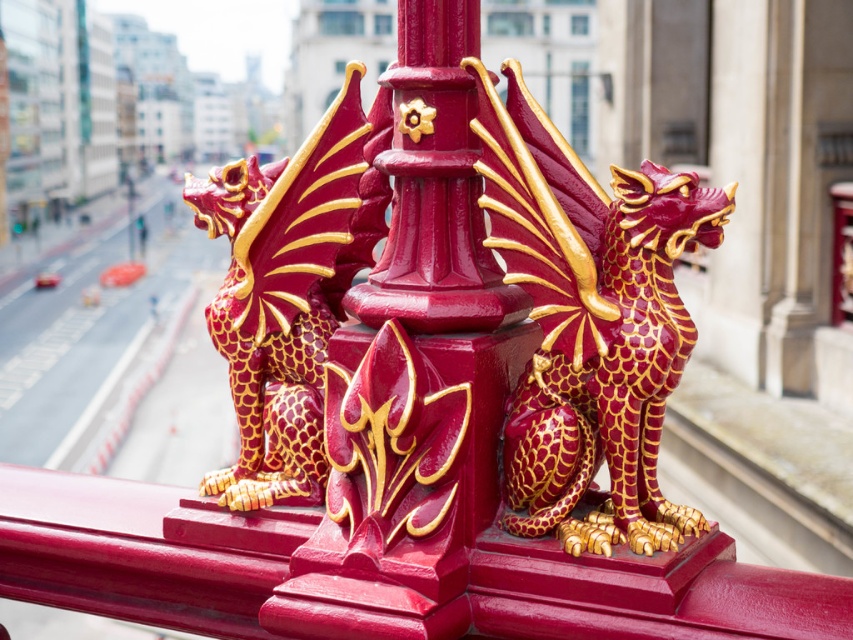
You are standing in front of the ornate red and gold decorative structure. There are two points marked on the structure. The first point is at coordinates point (610, 216) and the second point is at coordinates point (358, 84). Which point is closer to you?

Point (610, 216) is in front of point (358, 84), so it is closer to you.

Based on the photo, you are an architect examining the ornate red and gold decorative structure. You notice the matte red and gold dragon at center. Can you determine its exact position using the coordinate system provided?

The matte red and gold dragon at center is located at point coordinates (590, 323).